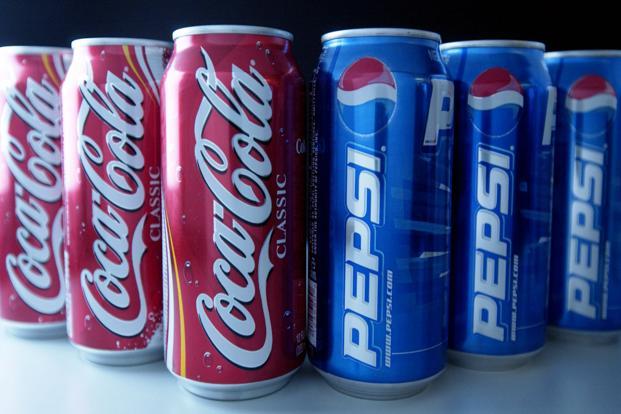
Where is `table`? table is located at coordinates (484, 390).